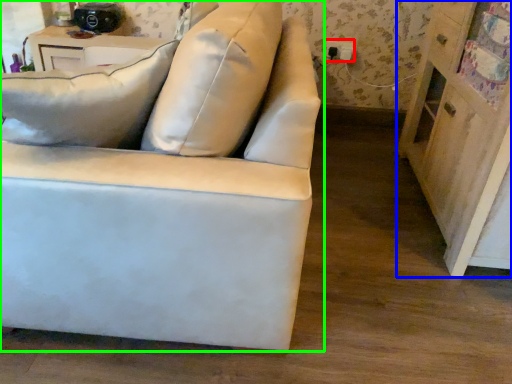
Question: Which object is the farthest from electric outlet (highlighted by a red box)? Choose among these: dresser (highlighted by a blue box) or studio couch (highlighted by a green box).

Choices:
 (A) dresser
 (B) studio couch

Answer: (B)